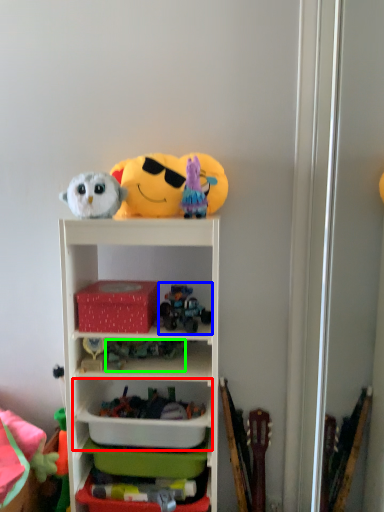
Question: Considering the real-world distances, which object is closest to cabinet (highlighted by a red box)? toy (highlighted by a blue box) or toy (highlighted by a green box).

Choices:
 (A) toy
 (B) toy

Answer: (B)